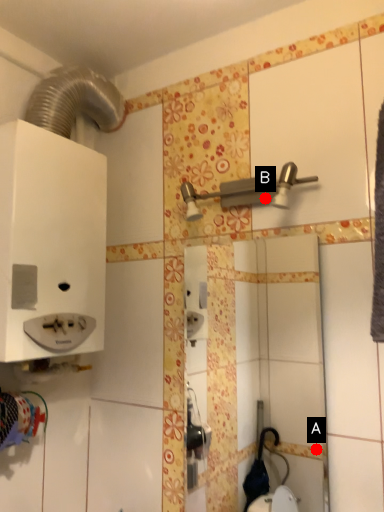
Question: Two points are circled on the image, labeled by A and B beside each circle. Which of the following is the farthest from the observer?

Choices:
 (A) A is further
 (B) B is further

Answer: (A)